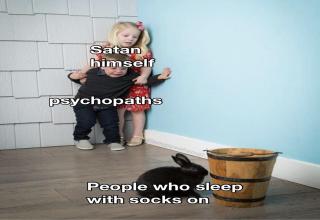
I want to click on bucket, so click(x=236, y=173).